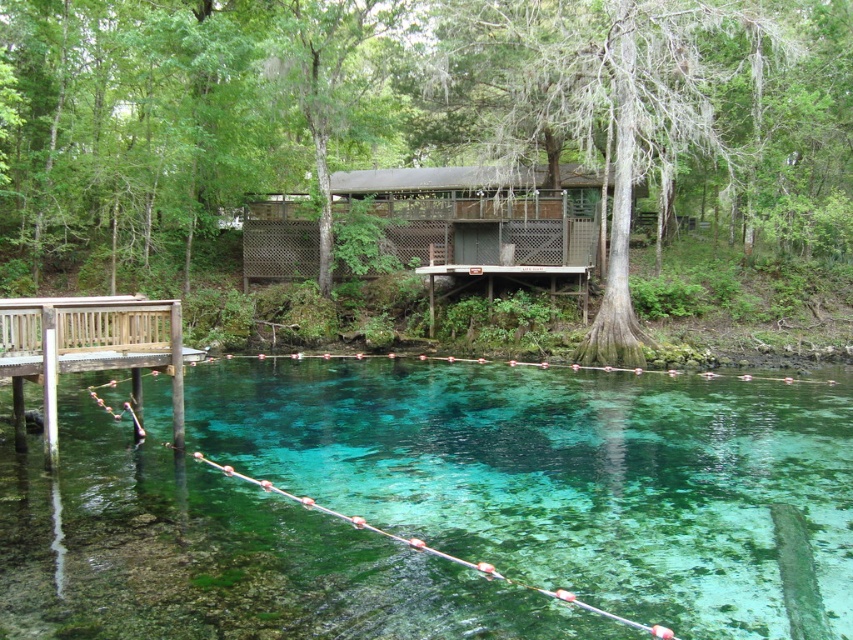
You are planning to build a small garden between the green mossy tree at center and the brown wooden cabin at center. Which object should you consider the spacing around due to its larger width?

The green mossy tree at center has a larger width than the brown wooden cabin at center, so you should consider spacing around the green mossy tree at center.